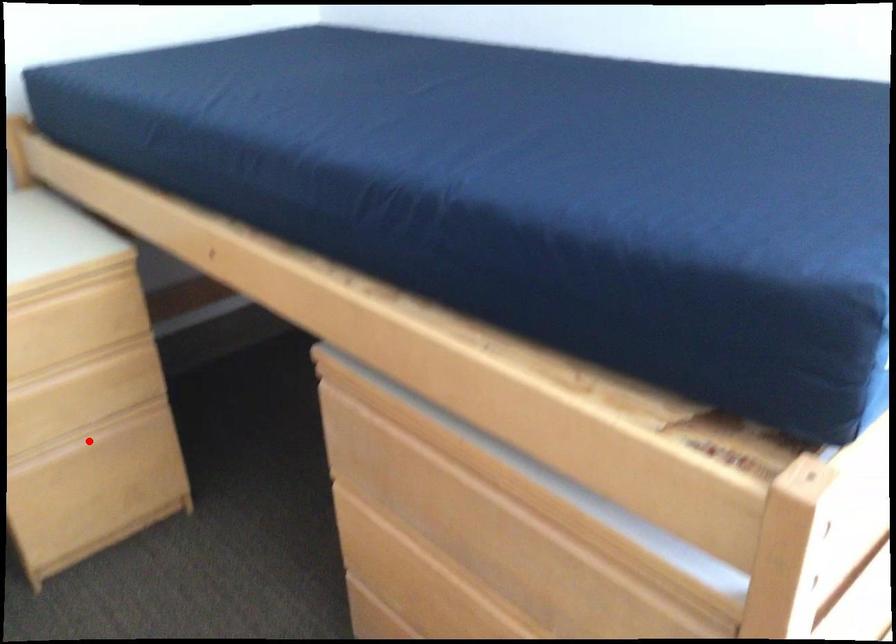
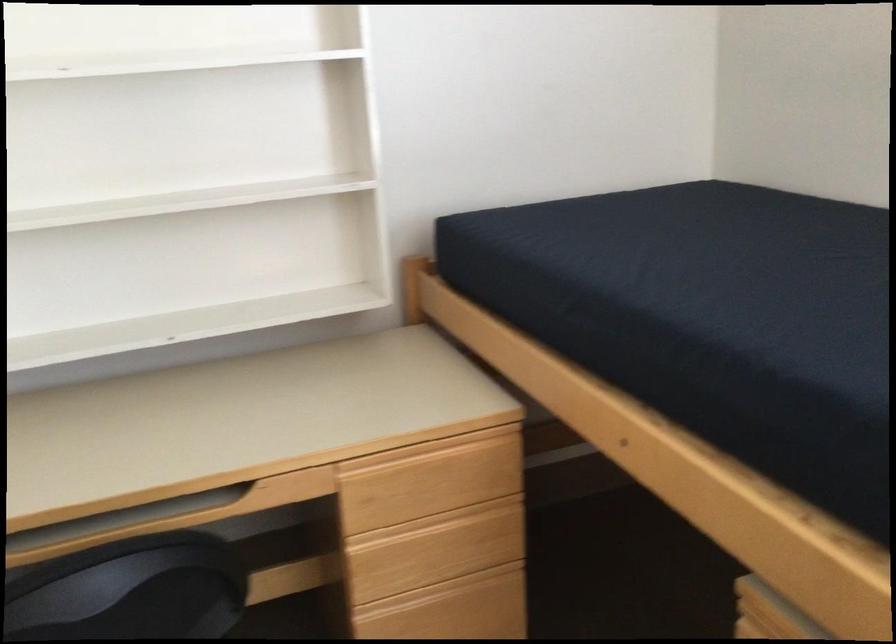
Question: I am providing you with two images of the same scene from different viewpoints. A red point is marked on the first image. At the location where the point appears in image 1, is it still visible in image 2?

Choices:
 (A) Yes
 (B) No

Answer: (A)